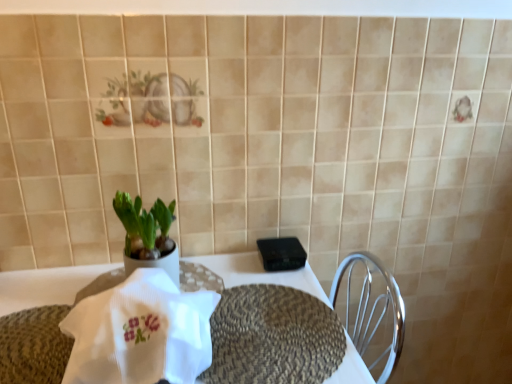
Where is `vacant space that's between black plastic device at center and braided woven placemat at center`? The image size is (512, 384). vacant space that's between black plastic device at center and braided woven placemat at center is located at coordinates (244, 275).